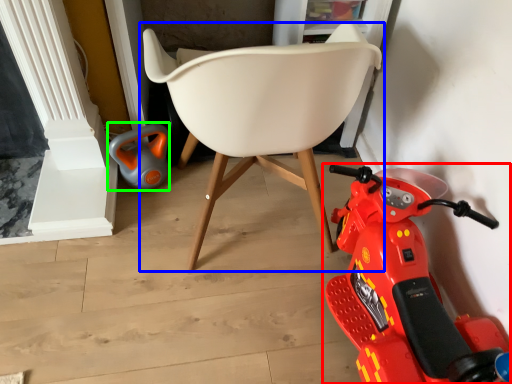
Question: Which is farther away from land vehicle (highlighted by a red box)? chair (highlighted by a blue box) or toy (highlighted by a green box)?

Choices:
 (A) chair
 (B) toy

Answer: (B)